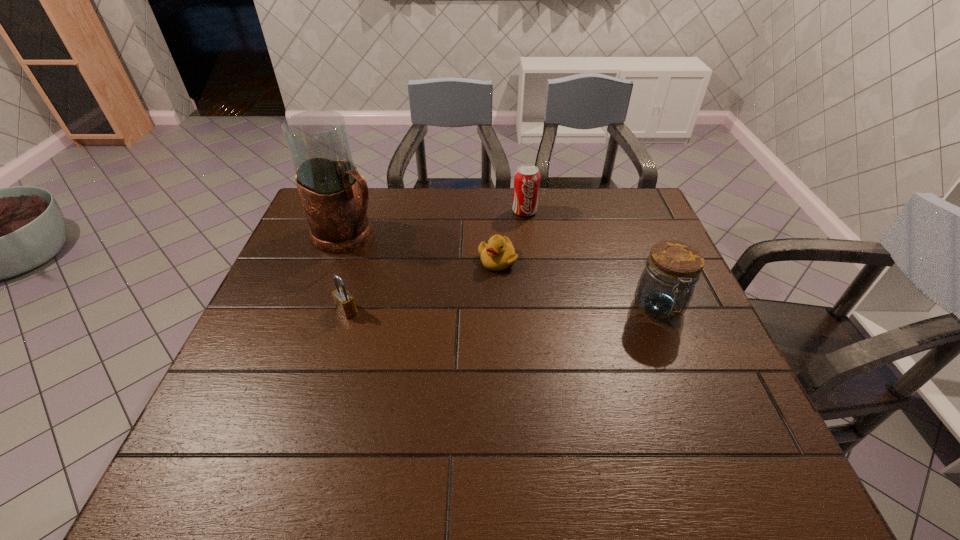
Find the location of a particular element. free space on the desktop that is between the padlock and the rightmost object and is positioned on the logo side of the soda can is located at coordinates (543, 309).

The height and width of the screenshot is (540, 960). I want to click on vacant space on the desktop that is between the fourth tallest object and the rightmost object and is positioned with the handle on the side of the pitcher, so pyautogui.click(x=482, y=309).

Find the location of a particular element. free space on the desktop that is between the second shortest object and the rightmost object and is positioned on the front-facing side of the duckling is located at coordinates (471, 309).